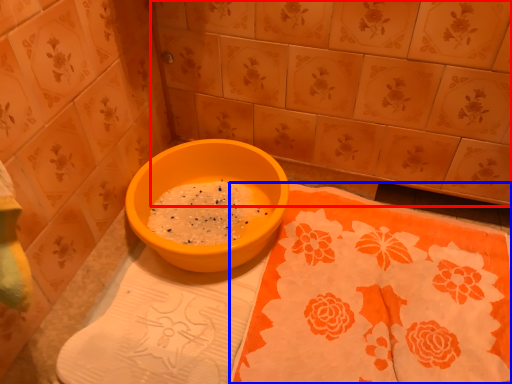
Question: Which point is closer to the camera, ceramic tile (highlighted by a red box) or tablecloth (highlighted by a blue box)?

Choices:
 (A) ceramic tile
 (B) tablecloth

Answer: (B)